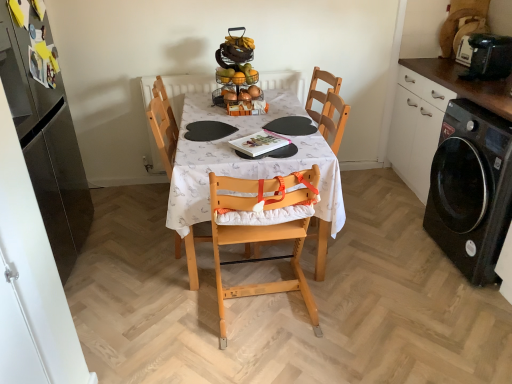
At what (x,y) coordinates should I click in order to perform the action: click on free area below light wood highchair at center, which is the 2th chair in left-to-right order (from a real-world perspective). Please return your answer as a coordinate pair (x, y). This screenshot has width=512, height=384. Looking at the image, I should click on (269, 309).